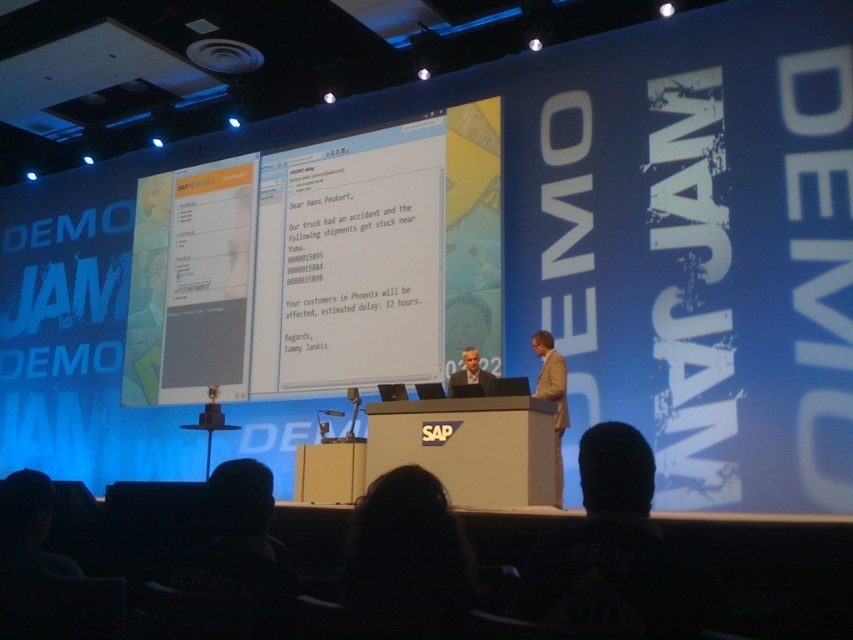
Does tan fabric suit at center have a greater width compared to light brown suit at center?

No.

Who is shorter, tan fabric suit at center or light brown suit at center?

Standing shorter between the two is light brown suit at center.

Is point (556, 481) positioned in front of point (480, 385)?

No, (556, 481) is behind (480, 385).

The image size is (853, 640). Identify the location of tan fabric suit at center. (552, 397).